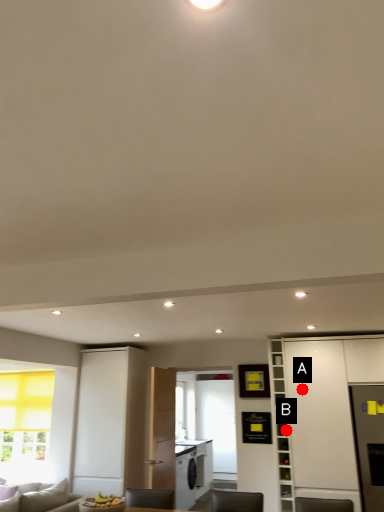
Question: Two points are circled on the image, labeled by A and B beside each circle. Which point is farther to the camera?

Choices:
 (A) A is further
 (B) B is further

Answer: (A)